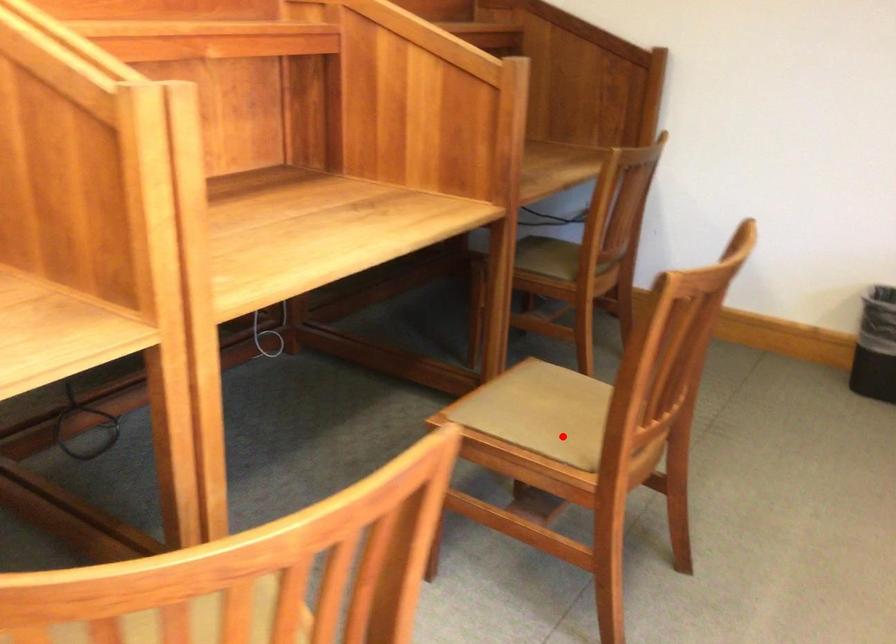
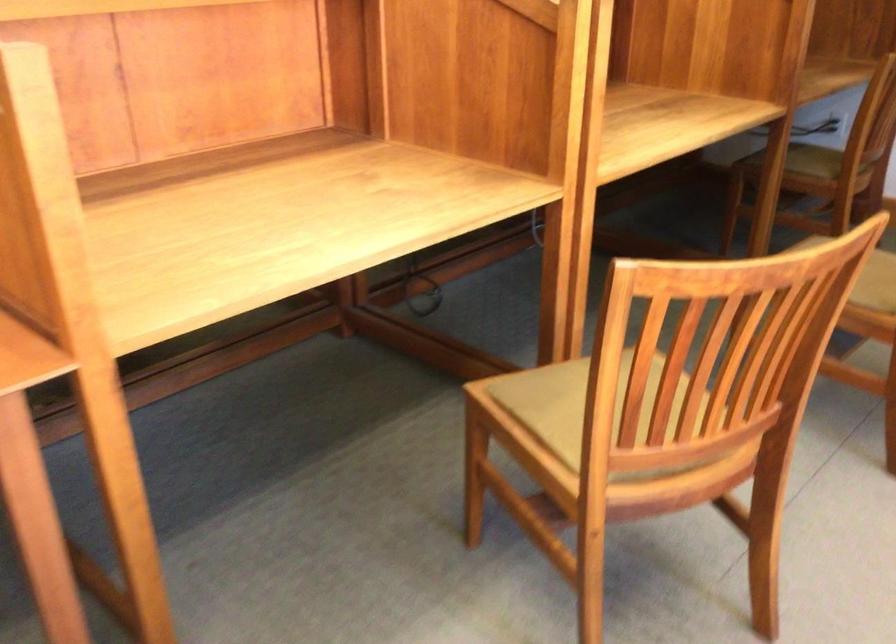
Find the pixel in the second image that matches the highlighted location in the first image.

(869, 275)